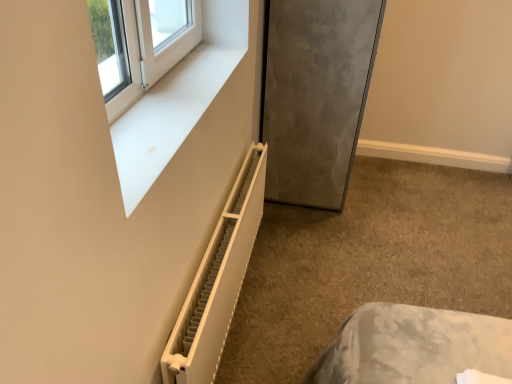
Question: Is white plastic radiator at lower left further to the viewer compared to satin gray refrigerator at lower right?

Choices:
 (A) no
 (B) yes

Answer: (A)

Question: Is white plastic radiator at lower left looking in the opposite direction of satin gray refrigerator at lower right?

Choices:
 (A) yes
 (B) no

Answer: (B)

Question: From a real-world perspective, is white plastic radiator at lower left below satin gray refrigerator at lower right?

Choices:
 (A) no
 (B) yes

Answer: (B)

Question: Is white plastic radiator at lower left next to satin gray refrigerator at lower right?

Choices:
 (A) no
 (B) yes

Answer: (A)

Question: From the image's perspective, is white plastic radiator at lower left beneath satin gray refrigerator at lower right?

Choices:
 (A) yes
 (B) no

Answer: (A)

Question: Does white plastic radiator at lower left have a greater width compared to satin gray refrigerator at lower right?

Choices:
 (A) yes
 (B) no

Answer: (B)

Question: From a real-world perspective, is white matte radiator at lower left over white plastic radiator at lower left?

Choices:
 (A) yes
 (B) no

Answer: (B)

Question: Does white matte radiator at lower left touch white plastic radiator at lower left?

Choices:
 (A) no
 (B) yes

Answer: (A)

Question: Considering the relative positions of white matte radiator at lower left and white plastic radiator at lower left in the image provided, is white matte radiator at lower left to the left of white plastic radiator at lower left from the viewer's perspective?

Choices:
 (A) no
 (B) yes

Answer: (A)

Question: Is white matte radiator at lower left closer to the viewer compared to white plastic radiator at lower left?

Choices:
 (A) no
 (B) yes

Answer: (A)

Question: Is white matte radiator at lower left wider than white plastic radiator at lower left?

Choices:
 (A) no
 (B) yes

Answer: (B)

Question: Is white matte radiator at lower left shorter than white plastic radiator at lower left?

Choices:
 (A) yes
 (B) no

Answer: (A)

Question: From the image's perspective, is white plastic window frame at upper left above white matte radiator at lower left?

Choices:
 (A) yes
 (B) no

Answer: (A)